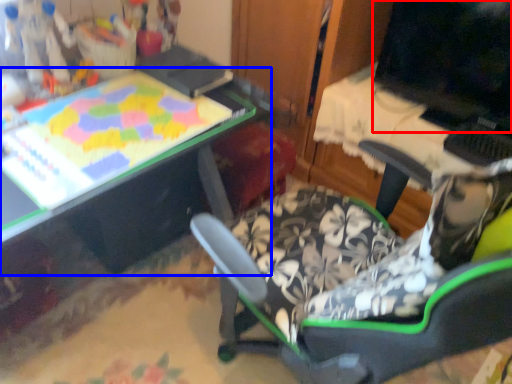
Question: Which object appears farthest to the camera in this image, computer monitor (highlighted by a red box) or table (highlighted by a blue box)?

Choices:
 (A) computer monitor
 (B) table

Answer: (A)